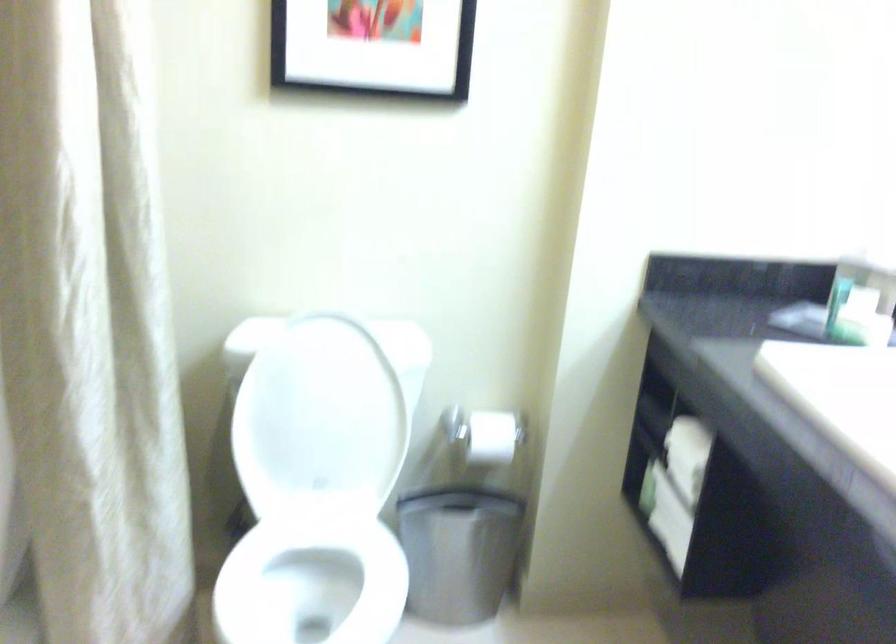
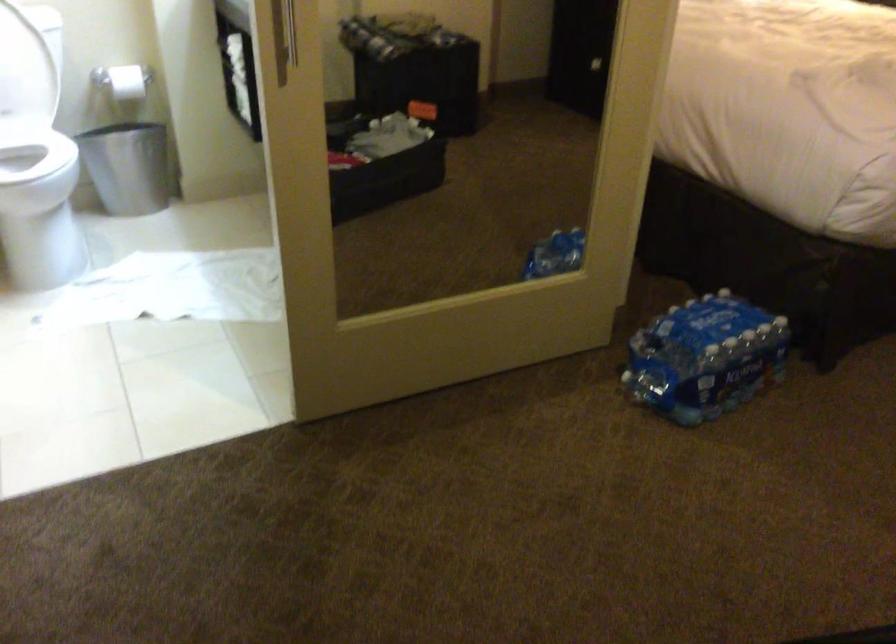
Question: In a continuous first-person perspective shot, in which direction is the camera moving?

Choices:
 (A) Left
 (B) Right
 (C) Forward
 (D) Backward

Answer: (D)